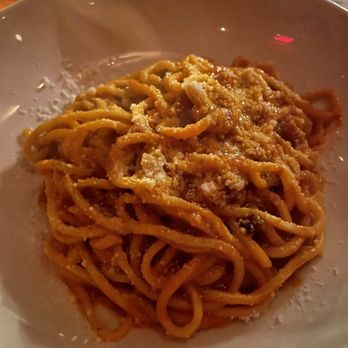
Locate an element on the screen. The image size is (348, 348). white plate is located at coordinates (288, 322).